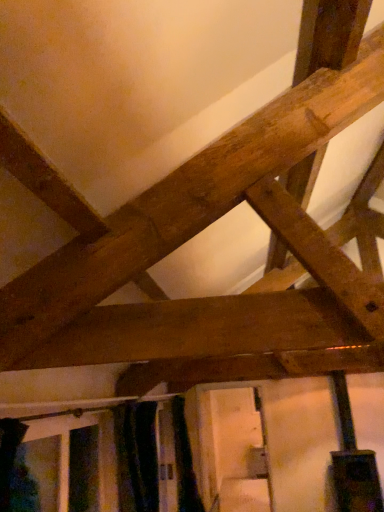
This screenshot has width=384, height=512. Describe the element at coordinates (137, 456) in the screenshot. I see `velvet dark green curtain at lower center` at that location.

Measure the distance between point (121, 435) and camera.

The distance of point (121, 435) from camera is 10.68 feet.

Identify the location of velvet dark green curtain at lower center. This screenshot has height=512, width=384. (137, 456).

At what (x,y) coordinates should I click in order to perform the action: click on velvet dark green curtain at lower center. Please return your answer as a coordinate pair (x, y). Looking at the image, I should click on (137, 456).